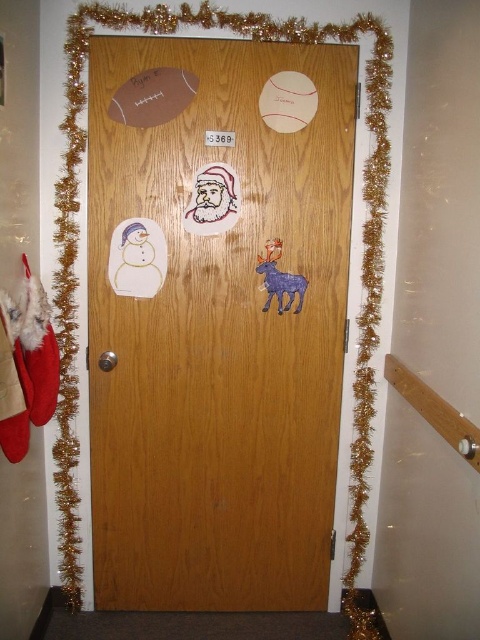
Does wooden door at center have a lesser height compared to matte paper santa at center?

Incorrect, wooden door at center's height does not fall short of matte paper santa at center's.

Looking at this image, is wooden door at center bigger than matte paper santa at center?

Correct, wooden door at center is larger in size than matte paper santa at center.

Who is more forward, (166,259) or (235,211)?

Point (235,211) is more forward.

At what (x,y) coordinates should I click in order to perform the action: click on wooden door at center. Please return your answer as a coordinate pair (x, y). This screenshot has width=480, height=640. Looking at the image, I should click on (216, 321).